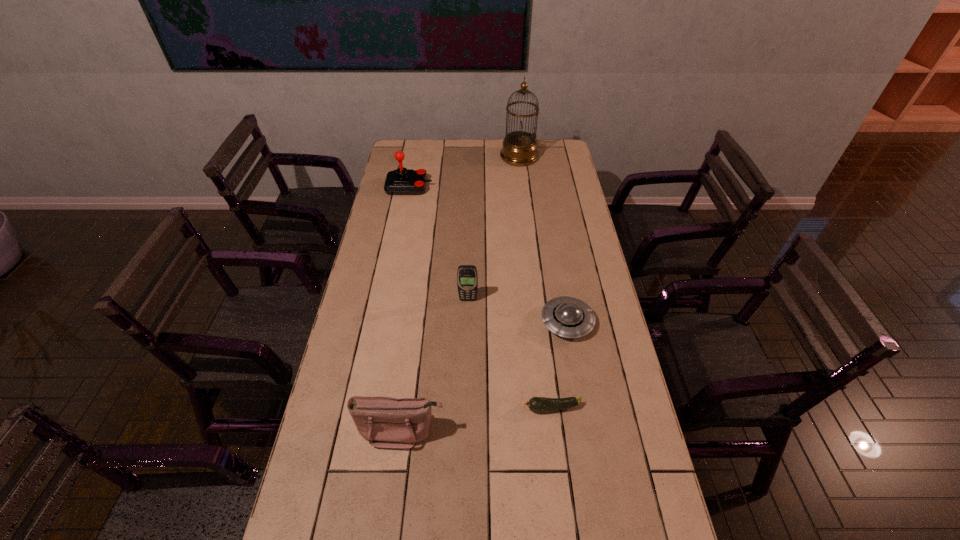
The image size is (960, 540). Find the location of `free spot between the second farthest object and the zucchini`. free spot between the second farthest object and the zucchini is located at coordinates (480, 298).

Find the location of a particular element. This screenshot has width=960, height=540. free space that is in between the third object from left to right and the third nearest object is located at coordinates (517, 311).

Identify the location of vacant point located between the shoulder bag and the saucer. (484, 376).

You are a GUI agent. You are given a task and a screenshot of the screen. Output one action in this format:
    pyautogui.click(x=<x>, y=<y>)
    Task: Click on the vacant space that's between the third object from left to right and the saucer
    This screenshot has height=540, width=960.
    Given the screenshot: What is the action you would take?
    pyautogui.click(x=517, y=311)

Locate an element on the screen. This screenshot has height=540, width=960. free point between the saucer and the shoulder bag is located at coordinates (484, 376).

Locate an element on the screen. This screenshot has width=960, height=540. unoccupied position between the saucer and the joystick is located at coordinates (488, 254).

Locate an element on the screen. The width and height of the screenshot is (960, 540). vacant area between the birdcage and the fourth object from right to left is located at coordinates (493, 228).

I want to click on vacant area that lies between the third farthest object and the zucchini, so click(510, 354).

This screenshot has height=540, width=960. In order to click on object that is the fifth nearest to the third nearest object in this screenshot , I will do `click(519, 148)`.

Find the location of a particular element. The image size is (960, 540). object that is the closest to the shoulder bag is located at coordinates (536, 404).